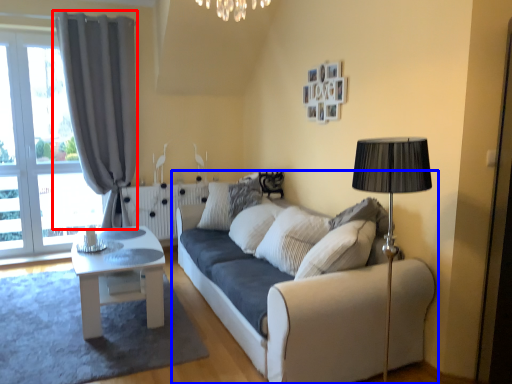
Question: Which of the following is the farthest to the observer, curtain (highlighted by a red box) or studio couch (highlighted by a blue box)?

Choices:
 (A) curtain
 (B) studio couch

Answer: (A)